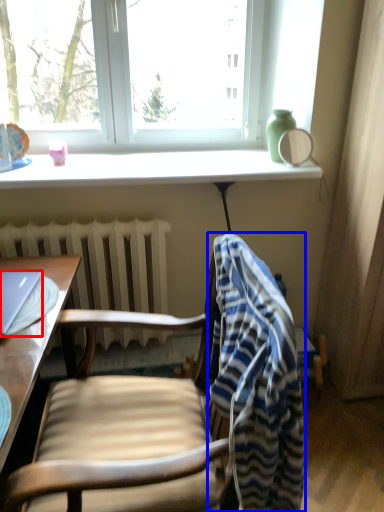
Question: Among these objects, which one is nearest to the camera, laptop (highlighted by a red box) or bath towel (highlighted by a blue box)?

Choices:
 (A) laptop
 (B) bath towel

Answer: (B)